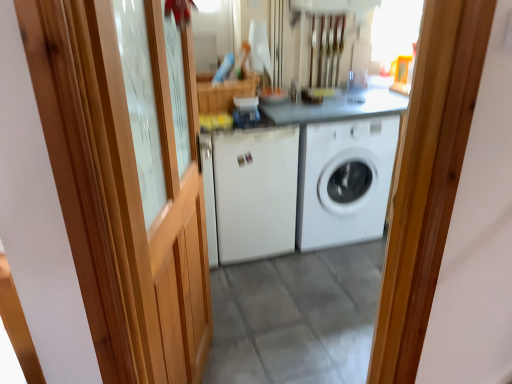
Find the location of `free spot above white matte washing machine at center, arranged as the second washing machine when viewed from the left (from a real-world perspective)`. free spot above white matte washing machine at center, arranged as the second washing machine when viewed from the left (from a real-world perspective) is located at coordinates (348, 102).